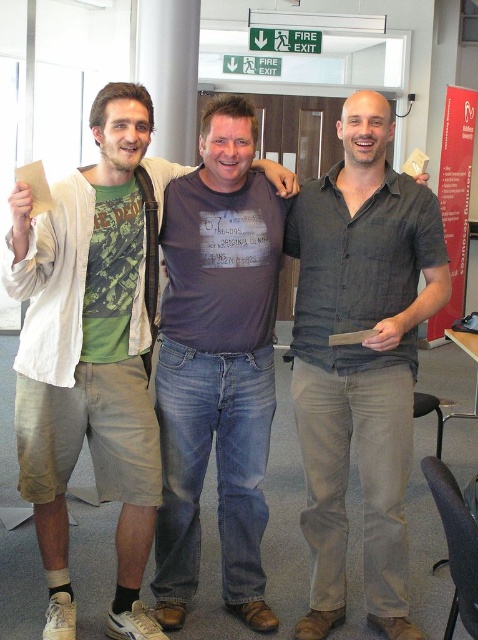
You are standing 5 feet away from the point at coordinates point [56,605]. If you take a step forward, will you be closer to the point?

The distance of point [56,605] from viewer is 7.06 feet. If you take a step forward, you will be closer to the point.